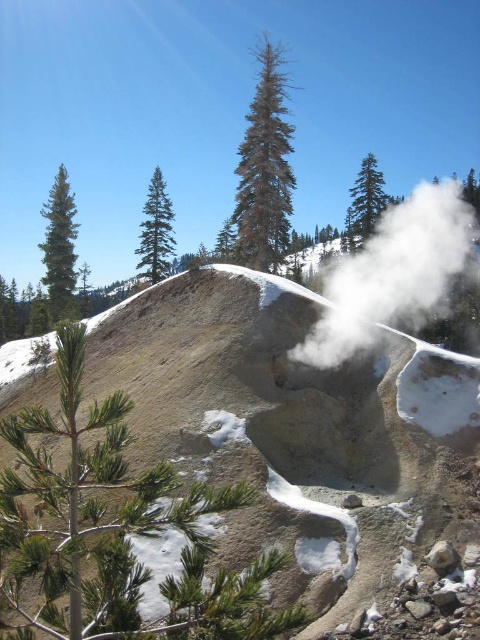
Question: Which object appears closest to the camera in this image?

Choices:
 (A) green matte tree at center
 (B) green matte tree at upper center
 (C) gray-brown coniferous tree at center

Answer: (C)

Question: Does gray-brown coniferous tree at center have a smaller size compared to green matte tree at left?

Choices:
 (A) yes
 (B) no

Answer: (B)

Question: Does green needle-like tree at center have a smaller size compared to green matte tree at center?

Choices:
 (A) yes
 (B) no

Answer: (A)

Question: Which object is farther from the camera taking this photo?

Choices:
 (A) green matte tree at left
 (B) green matte tree at center
 (C) gray-brown coniferous tree at center

Answer: (B)

Question: Does green matte tree at center lie behind green matte tree at upper center?

Choices:
 (A) yes
 (B) no

Answer: (A)

Question: Which is nearer to the gray-brown coniferous tree at center?

Choices:
 (A) green textured pine tree at upper center
 (B) green matte tree at center

Answer: (B)